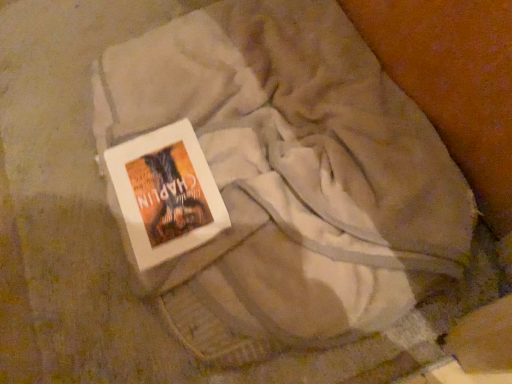
Question: Is white paper book at center taller than white soft blanket at center?

Choices:
 (A) yes
 (B) no

Answer: (B)

Question: Is white paper book at center smaller than white soft blanket at center?

Choices:
 (A) yes
 (B) no

Answer: (A)

Question: Is white paper book at center to the left of white soft blanket at center from the viewer's perspective?

Choices:
 (A) no
 (B) yes

Answer: (B)

Question: Does white paper book at center come behind white soft blanket at center?

Choices:
 (A) no
 (B) yes

Answer: (B)

Question: Is white paper book at center bigger than white soft blanket at center?

Choices:
 (A) no
 (B) yes

Answer: (A)

Question: Is white paper book at center turned away from white soft blanket at center?

Choices:
 (A) no
 (B) yes

Answer: (B)

Question: Considering the relative sizes of white soft blanket at center and white paper book at center in the image provided, is white soft blanket at center shorter than white paper book at center?

Choices:
 (A) no
 (B) yes

Answer: (A)

Question: Is white soft blanket at center facing towards white paper book at center?

Choices:
 (A) no
 (B) yes

Answer: (B)

Question: Are white soft blanket at center and white paper book at center beside each other?

Choices:
 (A) no
 (B) yes

Answer: (A)

Question: Is white soft blanket at center not close to white paper book at center?

Choices:
 (A) no
 (B) yes

Answer: (A)

Question: Is white soft blanket at center outside of white paper book at center?

Choices:
 (A) yes
 (B) no

Answer: (A)

Question: Considering the relative sizes of white soft blanket at center and white paper book at center in the image provided, is white soft blanket at center smaller than white paper book at center?

Choices:
 (A) no
 (B) yes

Answer: (A)

Question: From the image's perspective, is white paper book at center positioned above or below white soft blanket at center?

Choices:
 (A) above
 (B) below

Answer: (B)